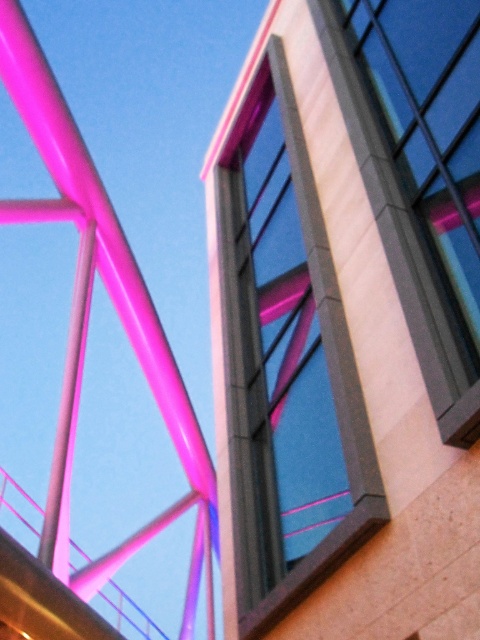
Is matte glass window at center further to the viewer compared to matte glass window at upper right?

That is False.

From the picture: Does matte glass window at center have a lesser width compared to matte glass window at upper right?

Incorrect, matte glass window at center's width is not less than matte glass window at upper right's.

This screenshot has width=480, height=640. Find the location of `matte glass window at center`. matte glass window at center is located at coordinates (284, 369).